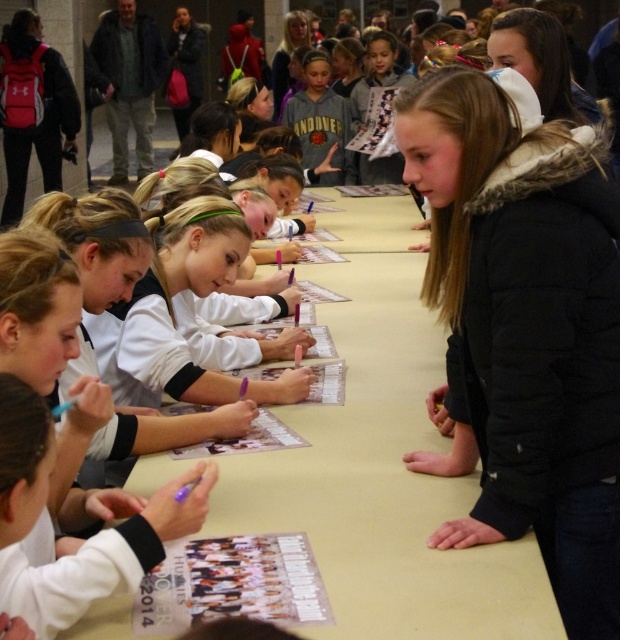
Is black fuzzy jacket at center further to the viewer compared to beige paper at center?

Yes, it is.

Which of these two, black fuzzy jacket at center or beige paper at center, stands shorter?

Standing shorter between the two is beige paper at center.

Between point (590, 256) and point (528, 584), which one is positioned in front?

Point (528, 584)

Image resolution: width=620 pixels, height=640 pixels. Identify the location of black fuzzy jacket at center. point(527,324).

Is beige paper at center shorter than gray hoodie at center?

Yes.

Between beige paper at center and gray hoodie at center, which one appears on the left side from the viewer's perspective?

gray hoodie at center

Where is `beige paper at center`? beige paper at center is located at coordinates (383, 465).

Is black fuzzy jacket at center positioned in front of gray hoodie at center?

Yes, black fuzzy jacket at center is in front of gray hoodie at center.

In order to click on black fuzzy jacket at center in this screenshot , I will do `click(527, 324)`.

I want to click on black fuzzy jacket at center, so click(x=527, y=324).